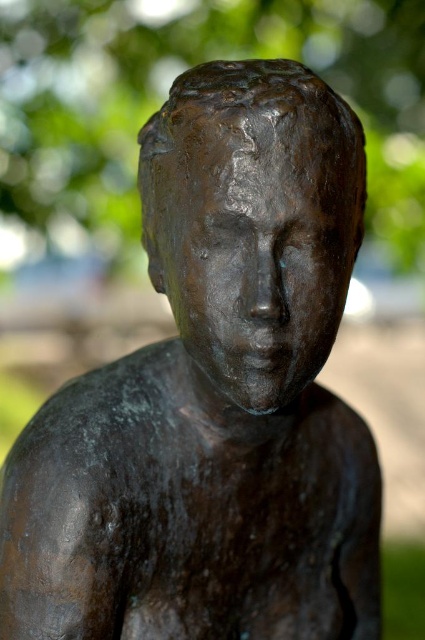
You are an art conservator examining the bronze statue at center and the green matte tree at center in the image. Which object occupies more space in the scene?

The green matte tree at center is bigger than the bronze statue at center, so it occupies more space in the scene.

You are an art student standing in front of the bronze statue at center and the green matte tree at center. You want to sketch the scene as it appears from your perspective. Which object should you draw first if you follow the standard left to right drawing technique?

The green matte tree at center should be drawn first because it is positioned on the left side of the bronze statue at center, so following left to right, you would start with the green matte tree at center.